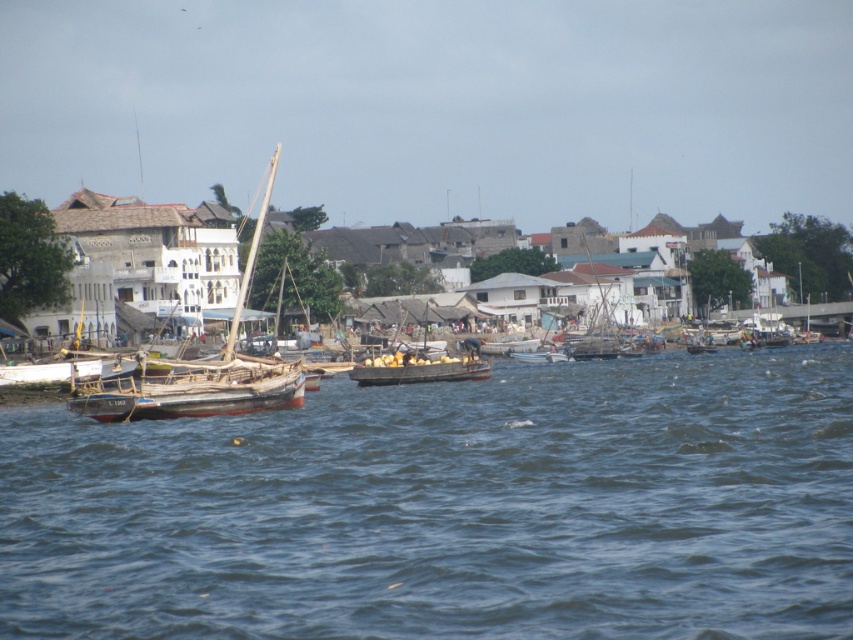
Question: Which of the following is the farthest from the observer?

Choices:
 (A) (418, 362)
 (B) (608, 374)
 (C) (149, 266)

Answer: (C)

Question: Considering the real-world distances, which object is farthest from the wooden boat at center?

Choices:
 (A) blue water at center
 (B) wooden sailboat at left

Answer: (B)

Question: Does wooden sailboat at left have a larger size compared to wooden boat at center?

Choices:
 (A) yes
 (B) no

Answer: (A)

Question: Can you confirm if wooden sailboat at left is bigger than wooden boat at center?

Choices:
 (A) yes
 (B) no

Answer: (A)

Question: Which of the following is the closest to the observer?

Choices:
 (A) (384, 372)
 (B) (474, 621)
 (C) (279, 376)

Answer: (B)

Question: Can you confirm if wooden sailboat at left is smaller than wooden boat at center?

Choices:
 (A) no
 (B) yes

Answer: (A)